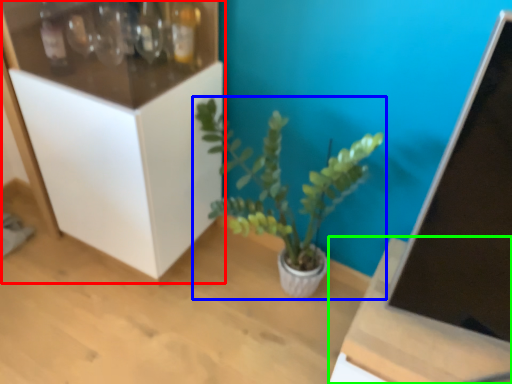
Question: Estimate the real-world distances between objects in this image. Which object is farther from cabinetry (highlighted by a red box), houseplant (highlighted by a blue box) or table (highlighted by a green box)?

Choices:
 (A) houseplant
 (B) table

Answer: (B)